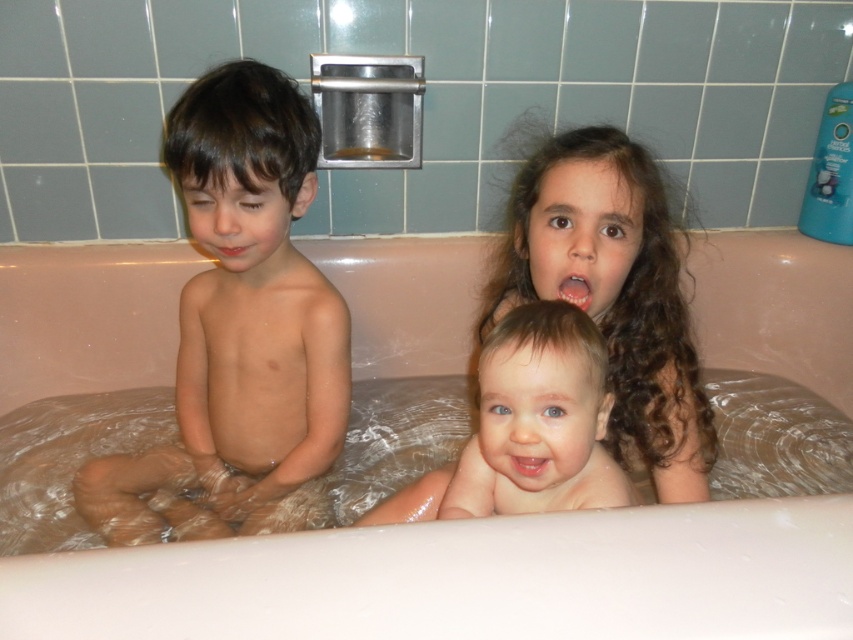
Who is more forward, [695,365] or [344,19]?

Point [695,365] is in front.

Does curly hair at center have a lesser width compared to transparent plastic bubble at upper center?

Incorrect, curly hair at center's width is not less than transparent plastic bubble at upper center's.

Is point (546, 198) more distant than point (339, 13)?

No, it is not.

Where is `curly hair at center`? This screenshot has height=640, width=853. curly hair at center is located at coordinates (614, 291).

Does smooth skin boy at left have a greater width compared to transparent plastic bubble at upper center?

Correct, the width of smooth skin boy at left exceeds that of transparent plastic bubble at upper center.

Is smooth skin boy at left closer to the viewer compared to transparent plastic bubble at upper center?

Yes, it is in front of transparent plastic bubble at upper center.

The width and height of the screenshot is (853, 640). Identify the location of smooth skin boy at left. (238, 324).

The width and height of the screenshot is (853, 640). Find the location of `smooth skin boy at left`. smooth skin boy at left is located at coordinates (238, 324).

Which is below, curly hair at center or matte skin mouth at left?

curly hair at center is lower down.

Does curly hair at center have a greater height compared to matte skin mouth at left?

Indeed, curly hair at center has a greater height compared to matte skin mouth at left.

Which is in front, point (529, 156) or point (239, 256)?

Point (239, 256) is more forward.

I want to click on curly hair at center, so click(x=614, y=291).